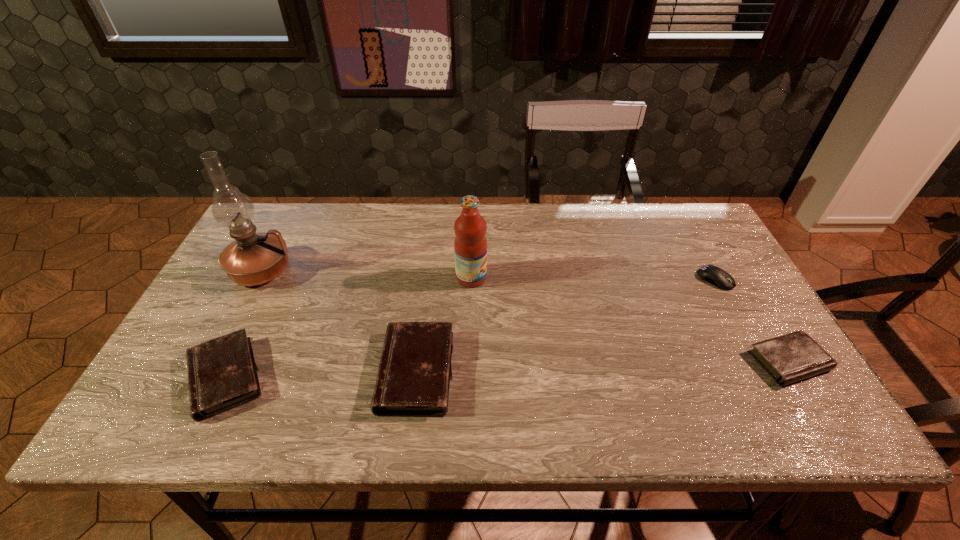
At what (x,y) coordinates should I click in order to perform the action: click on the leftmost diary. Please return your answer as a coordinate pair (x, y). Looking at the image, I should click on (222, 374).

This screenshot has height=540, width=960. What are the coordinates of `the second tallest diary` in the screenshot? It's located at (222, 374).

I want to click on the fourth shortest object, so click(x=414, y=373).

Find the location of a particular element. the second diary from left to right is located at coordinates (414, 373).

Where is `the shortest diary`? This screenshot has width=960, height=540. the shortest diary is located at coordinates (795, 356).

The height and width of the screenshot is (540, 960). I want to click on fruit juice, so click(470, 244).

Find the location of `oil lamp`. oil lamp is located at coordinates (253, 259).

You are a GUI agent. You are given a task and a screenshot of the screen. Output one action in this format:
    pyautogui.click(x=<x>, y=<y>)
    Task: Click on the computer equipment
    The image size is (960, 540).
    Given the screenshot: What is the action you would take?
    pyautogui.click(x=714, y=275)

Find the location of a particular element. This screenshot has height=540, width=960. free space located on the back of the second shortest diary is located at coordinates (284, 255).

This screenshot has width=960, height=540. In order to click on free location located on the left of the second diary from left to right in this screenshot , I will do `click(211, 372)`.